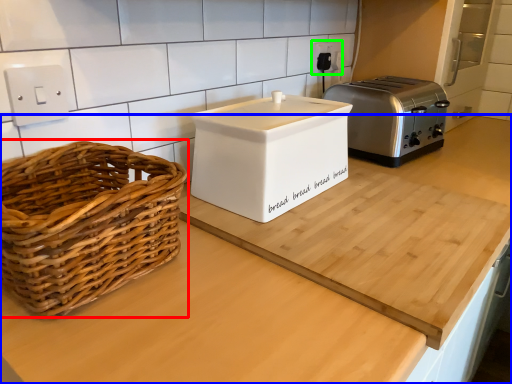
Question: Considering the real-world distances, which object is farthest from picnic basket (highlighted by a red box)? countertop (highlighted by a blue box) or electric outlet (highlighted by a green box)?

Choices:
 (A) countertop
 (B) electric outlet

Answer: (B)